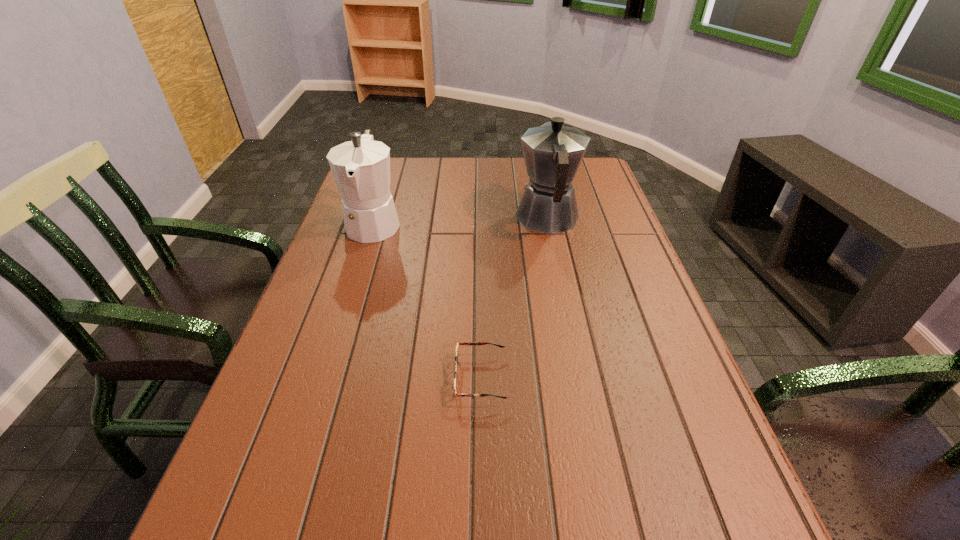
Where is `free region located on the frame of the shortest object`? The width and height of the screenshot is (960, 540). free region located on the frame of the shortest object is located at coordinates (398, 378).

At what (x,y) coordinates should I click in order to perform the action: click on object present at the left edge. Please return your answer as a coordinate pair (x, y). This screenshot has width=960, height=540. Looking at the image, I should click on (361, 168).

Where is `object present at the right edge`? This screenshot has width=960, height=540. object present at the right edge is located at coordinates (552, 152).

Image resolution: width=960 pixels, height=540 pixels. In order to click on free space at the far edge of the desktop in this screenshot , I will do `click(414, 191)`.

Where is `vacant area at the left edge`? The height and width of the screenshot is (540, 960). vacant area at the left edge is located at coordinates (228, 524).

In order to click on free spot at the right edge of the desktop in this screenshot , I will do `click(644, 316)`.

This screenshot has width=960, height=540. What are the coordinates of `vacant space at the far left corner of the desktop` in the screenshot? It's located at (395, 159).

At what (x,y) coordinates should I click in order to perform the action: click on vacant space at the far right corner of the desktop. Please return your answer as a coordinate pair (x, y). This screenshot has height=540, width=960. Looking at the image, I should click on (577, 188).

Locate an element on the screen. unoccupied area between the left coffeepot and the right coffeepot is located at coordinates (461, 221).

Locate an element on the screen. Image resolution: width=960 pixels, height=540 pixels. unoccupied area between the left coffeepot and the rightmost object is located at coordinates (461, 221).